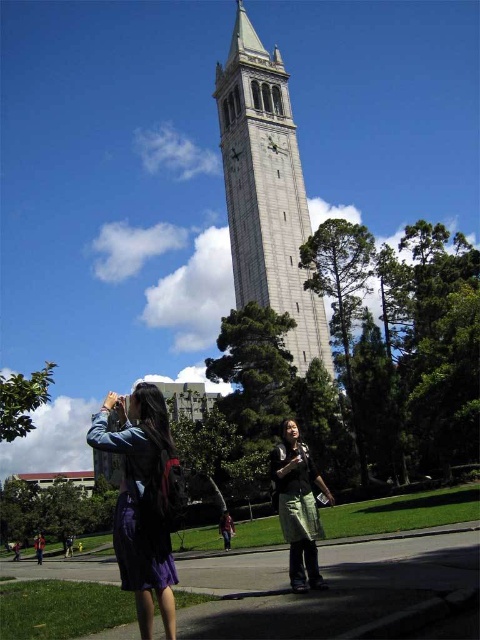
You are standing in front of the gray stone clock tower at center and the green fabric skirt at lower center. Which object is taller?

The gray stone clock tower at center is much taller than the green fabric skirt at lower center.

You are standing in front of the clock tower and want to take a photo of the two points marked in the image. Which point, point (239, 282) or point (305, 449), is closer to your camera lens?

Point (239, 282) is further to the camera than point (305, 449), so the point closer to your camera lens is point (305, 449).

You are standing in front of the gray stone clock tower at center and the green fabric skirt at lower center. Which object is positioned to the left?

The gray stone clock tower at center is positioned to the left of the green fabric skirt at lower center.